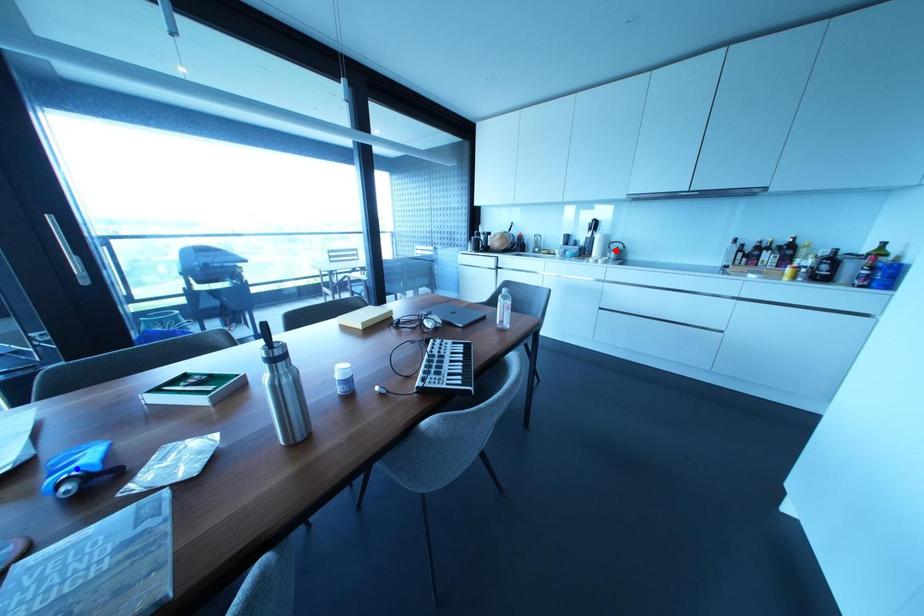
Question: In the image, two points are highlighted. Which point is nearer to the camera? Reply with the corresponding letter.

Choices:
 (A) blue point
 (B) red point

Answer: (A)